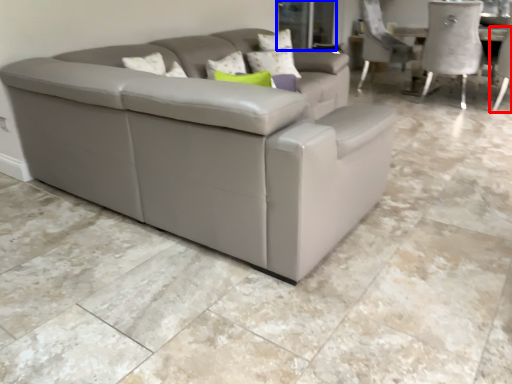
Question: Which point is further to the camera, chair (highlighted by a red box) or glass door (highlighted by a blue box)?

Choices:
 (A) chair
 (B) glass door

Answer: (B)